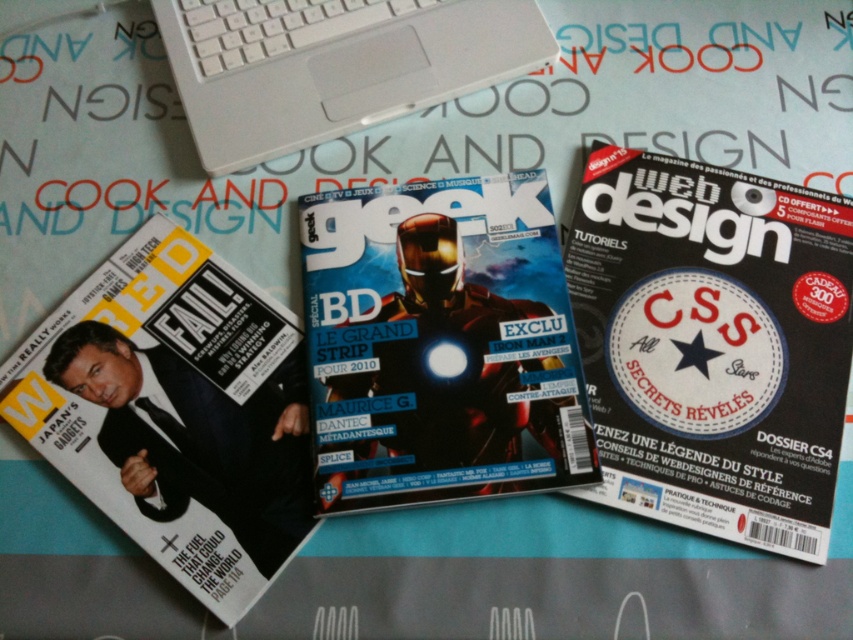
Question: Can you confirm if metallic silver magazine at center is thinner than matte black magazine at lower left?

Choices:
 (A) no
 (B) yes

Answer: (B)

Question: Among these objects, which one is nearest to the camera?

Choices:
 (A) white plastic laptop at upper center
 (B) matte black magazine at center
 (C) matte black magazine at lower left
 (D) metallic silver magazine at center

Answer: (C)

Question: Does matte black magazine at center appear on the left side of white plastic laptop at upper center?

Choices:
 (A) yes
 (B) no

Answer: (B)

Question: Which point is farther from the camera taking this photo?

Choices:
 (A) (404, 371)
 (B) (175, 284)
 (C) (234, 51)

Answer: (C)

Question: In this image, where is metallic silver magazine at center located relative to white plastic laptop at upper center?

Choices:
 (A) below
 (B) above

Answer: (A)

Question: Considering the real-world distances, which object is closest to the matte black magazine at lower left?

Choices:
 (A) metallic silver magazine at center
 (B) matte black magazine at center

Answer: (A)